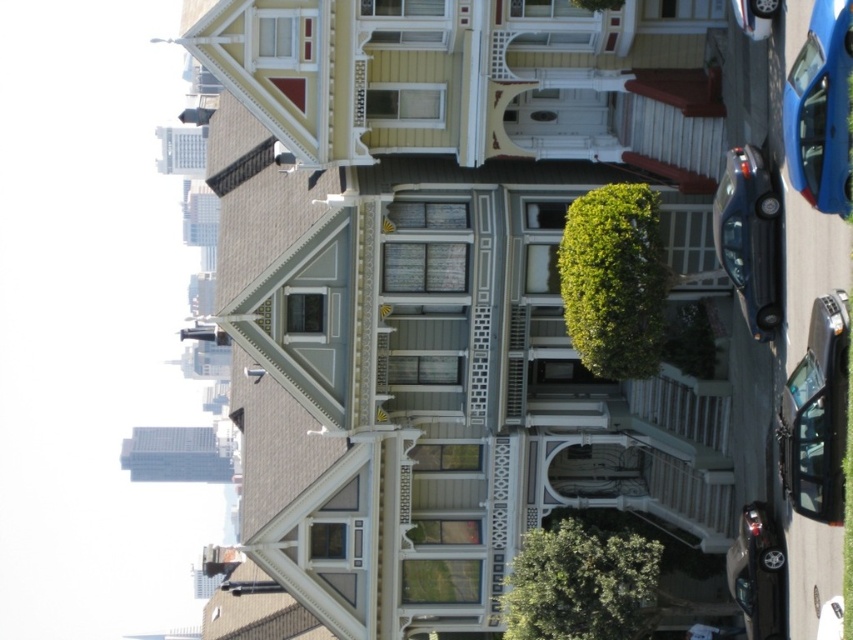
You are standing in front of the row of Victorian houses and want to place a small decorative flag at the point closer to you between the two points labeled point (x=809, y=134) and point (x=766, y=532). Which point should you choose?

You should choose point (x=809, y=134) because it is closer to the viewer than point (x=766, y=532).

You are standing at the front door of the central house and want to park your car in the driveway. Is the shiny black car at lower right blocking your path to the driveway?

The shiny black car at lower right is positioned at point (816, 416), which is near the lower right corner of the image. Since the driveway is likely located near the central house, the car is positioned away from the central house and would not block the driveway path.

You are a delivery person trying to park your van between the metallic blue car at right and the shiny black sedan at lower right. Can you fit your van, which is 6 meters long, in the space between them?

The metallic blue car at right is closer to the viewer than the shiny black sedan at lower right, so the distance between them is not specified. Without knowing the exact distance, it is impossible to determine if the van can fit.